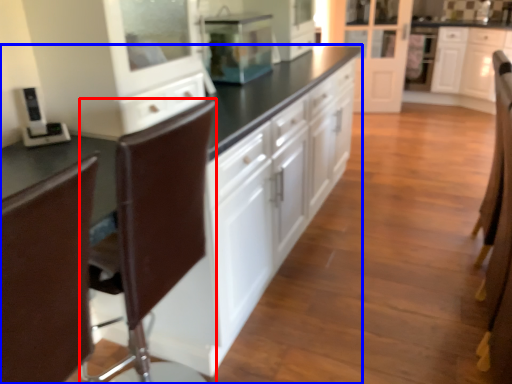
Question: Which of the following is the closest to the observer, swivel chair (highlighted by a red box) or cabinetry (highlighted by a blue box)?

Choices:
 (A) swivel chair
 (B) cabinetry

Answer: (A)